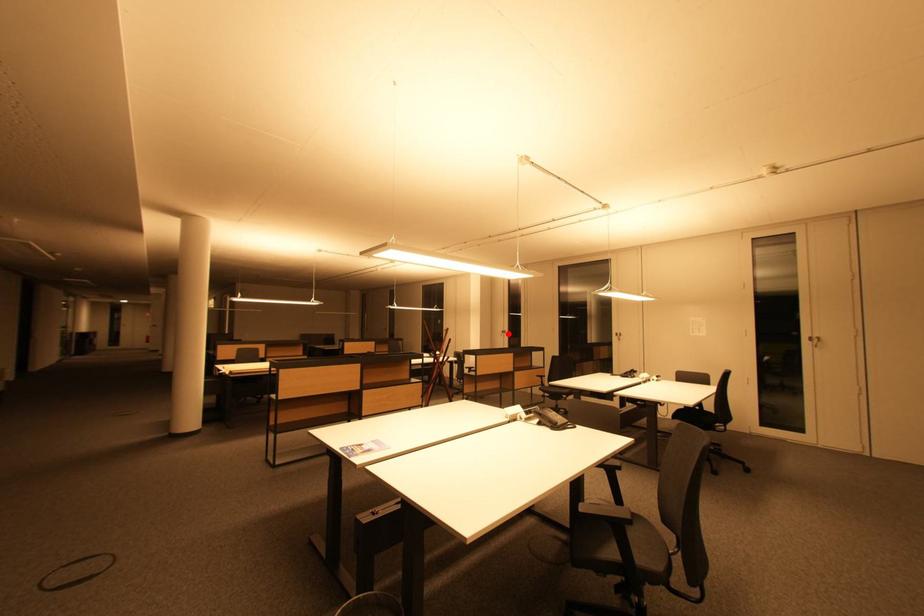
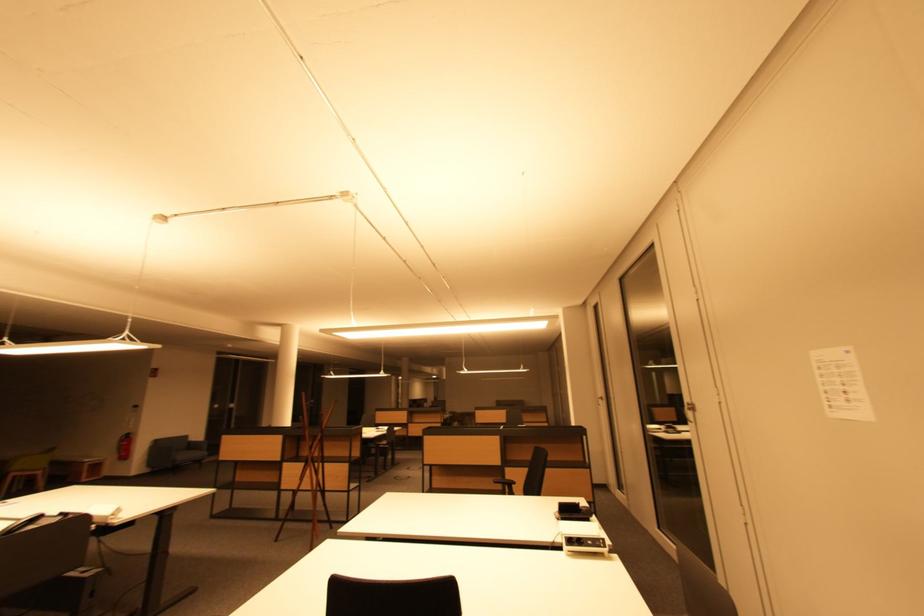
Locate, in the second image, the point that corresponds to the highlighted location in the first image.

(605, 400)